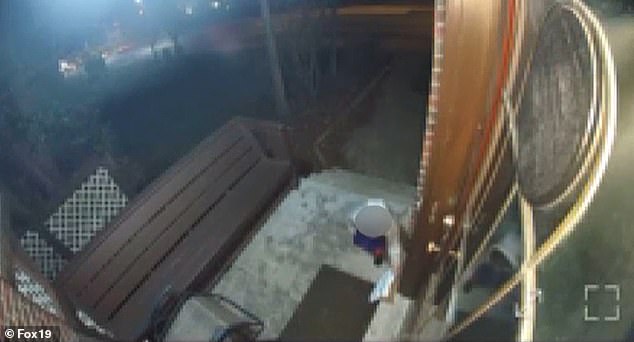
The image size is (634, 342). I want to click on door jamb, so click(x=462, y=27), click(x=443, y=149), click(x=424, y=233), click(x=409, y=282).